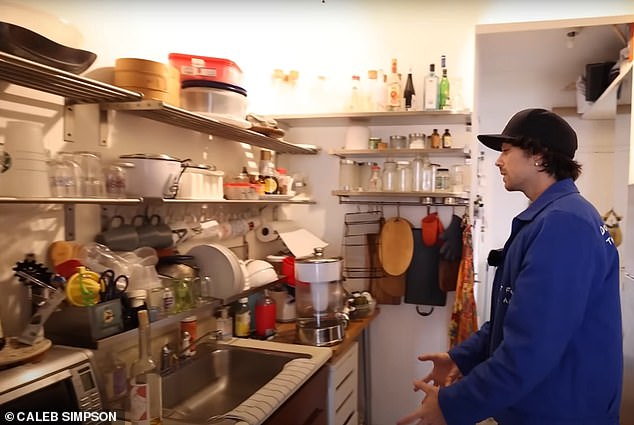
The width and height of the screenshot is (634, 425). I want to click on wall, so click(508, 94), click(241, 53).